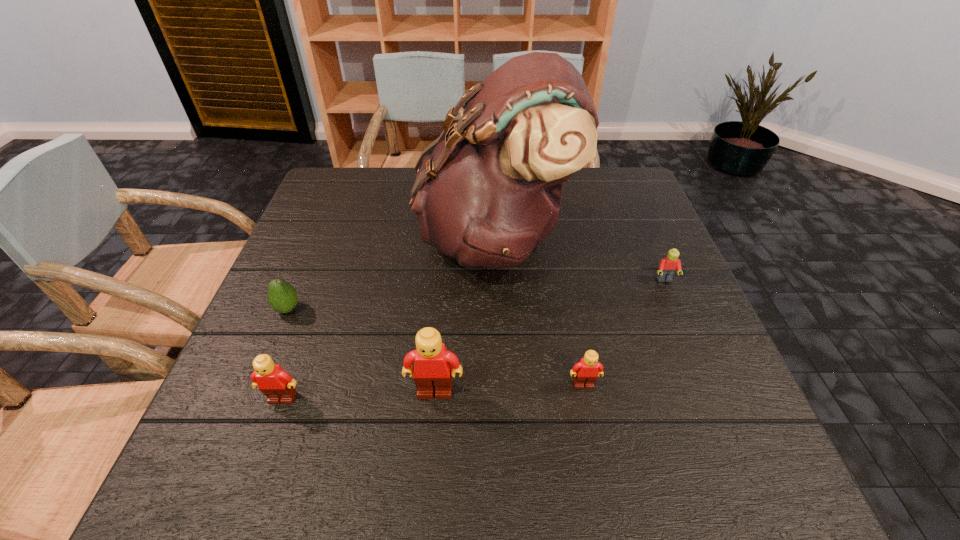
Identify the location of vacant region located 0.160m at the front of the tallest object with buckles. This screenshot has height=540, width=960. (356, 238).

Identify the location of free location located 0.120m at the front of the tallest object with buckles. The height and width of the screenshot is (540, 960). (372, 238).

Where is `vacant space located on the right of the avocado`? vacant space located on the right of the avocado is located at coordinates (437, 309).

The image size is (960, 540). In order to click on free region located on the face of the farthest Lego in this screenshot , I will do `click(698, 360)`.

Where is `object located in the far edge section of the desktop`? object located in the far edge section of the desktop is located at coordinates (488, 190).

Where is `Lego that is positioned at the left edge`? Lego that is positioned at the left edge is located at coordinates (278, 386).

Locate an element on the screen. avocado that is at the left edge is located at coordinates (282, 296).

What are the coordinates of `object present at the right edge` in the screenshot? It's located at (667, 268).

You are a GUI agent. You are given a task and a screenshot of the screen. Output one action in this format:
    pyautogui.click(x=<x>, y=<y>)
    Task: Click on the object present at the near left corner
    This screenshot has height=540, width=960.
    Given the screenshot: What is the action you would take?
    pyautogui.click(x=278, y=386)

Image resolution: width=960 pixels, height=540 pixels. I want to click on vacant region at the far edge of the desktop, so click(576, 176).